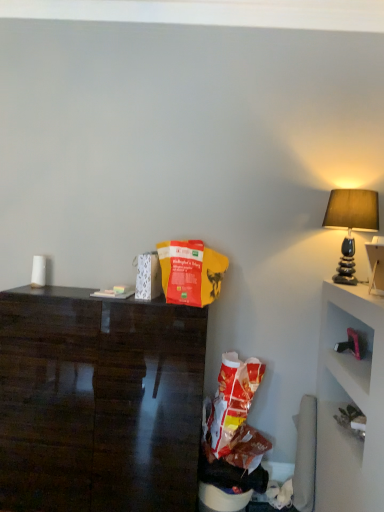
I want to click on red matte paper bag at center, so click(191, 272).

What is the approximate height of matte stone lamp at right?

22.49 inches.

Measure the distance between matte stone lamp at right and camera.

The distance of matte stone lamp at right from camera is 7.68 feet.

You are a GUI agent. You are given a task and a screenshot of the screen. Output one action in this format:
    pyautogui.click(x=<x>, y=<y>)
    Task: Click on the dark wood desk at left
    The width and height of the screenshot is (384, 512).
    Given the screenshot: What is the action you would take?
    pyautogui.click(x=98, y=403)

Based on the photo, does red matte paper bag at center come behind dark wood desk at left?

Yes, the depth of red matte paper bag at center is greater than that of dark wood desk at left.

From a real-world perspective, is red matte paper bag at center physically located above or below dark wood desk at left?

red matte paper bag at center is above dark wood desk at left.

From the picture: Can we say red matte paper bag at center lies outside dark wood desk at left?

Indeed, red matte paper bag at center is completely outside dark wood desk at left.

Locate an element on the screen. The height and width of the screenshot is (512, 384). desk below the red matte paper bag at center (from the image's perspective) is located at coordinates (98, 403).

Is point (208, 288) positioned behind point (332, 198)?

No, it is not.

From a real-world perspective, is red matte paper bag at center physically above matte stone lamp at right?

No, from a real-world perspective, red matte paper bag at center is not on top of matte stone lamp at right.

How distant is red matte paper bag at center from matte stone lamp at right?

red matte paper bag at center and matte stone lamp at right are 32.22 inches apart.

In the scene shown: Who is bigger, red matte paper bag at center or matte stone lamp at right?

With larger size is matte stone lamp at right.

Which point is more forward, (x=374, y=198) or (x=78, y=490)?

The point (x=374, y=198) is in front.

Considering the sizes of objects matte stone lamp at right and dark wood desk at left in the image provided, who is bigger, matte stone lamp at right or dark wood desk at left?

Bigger between the two is dark wood desk at left.

Locate an element on the screen. The height and width of the screenshot is (512, 384). lamp located behind the dark wood desk at left is located at coordinates (351, 224).

Considering the sizes of objects matte stone lamp at right and red matte paper bag at center in the image provided, who is smaller, matte stone lamp at right or red matte paper bag at center?

With smaller size is red matte paper bag at center.

Which of these two, matte stone lamp at right or red matte paper bag at center, is thinner?

Thinner between the two is red matte paper bag at center.

Does matte stone lamp at right turn towards red matte paper bag at center?

Yes, matte stone lamp at right faces towards red matte paper bag at center.

Is matte stone lamp at right positioned far away from red matte paper bag at center?

matte stone lamp at right is actually quite close to red matte paper bag at center.

Can you confirm if dark wood desk at left is shorter than matte stone lamp at right?

In fact, dark wood desk at left may be taller than matte stone lamp at right.

Are dark wood desk at left and matte stone lamp at right making contact?

No, dark wood desk at left is not beside matte stone lamp at right.

Is dark wood desk at left aimed at matte stone lamp at right?

No, dark wood desk at left is not oriented towards matte stone lamp at right.

Looking at this image, are dark wood desk at left and red matte paper bag at center making contact?

No, dark wood desk at left is not touching red matte paper bag at center.

From the image's perspective, does dark wood desk at left appear lower than red matte paper bag at center?

Correct, dark wood desk at left appears lower than red matte paper bag at center in the image.

Considering the relative sizes of dark wood desk at left and red matte paper bag at center in the image provided, is dark wood desk at left smaller than red matte paper bag at center?

Actually, dark wood desk at left might be larger than red matte paper bag at center.

Can you confirm if dark wood desk at left is taller than red matte paper bag at center?

Correct, dark wood desk at left is much taller as red matte paper bag at center.

The width and height of the screenshot is (384, 512). Find the location of `paper bag that appears behind the dark wood desk at left`. paper bag that appears behind the dark wood desk at left is located at coordinates (191, 272).

Locate an element on the screen. paper bag on the left of matte stone lamp at right is located at coordinates (191, 272).

Considering their positions, is red matte paper bag at center positioned further to matte stone lamp at right than dark wood desk at left?

dark wood desk at left is positioned further to the anchor matte stone lamp at right.

Looking at this image, from the image, which object appears to be farther from matte stone lamp at right, dark wood desk at left or red matte paper bag at center?

dark wood desk at left is further to matte stone lamp at right.

Based on their spatial positions, is matte stone lamp at right or red matte paper bag at center closer to dark wood desk at left?

red matte paper bag at center is positioned closer to the anchor dark wood desk at left.

Based on their spatial positions, is dark wood desk at left or matte stone lamp at right closer to red matte paper bag at center?

Among the two, dark wood desk at left is located nearer to red matte paper bag at center.

Which object lies nearer to the anchor point red matte paper bag at center, matte stone lamp at right or dark wood desk at left?

dark wood desk at left lies closer to red matte paper bag at center than the other object.

Estimate the real-world distances between objects in this image. Which object is further from dark wood desk at left, red matte paper bag at center or matte stone lamp at right?

matte stone lamp at right lies further to dark wood desk at left than the other object.

Identify the location of paper bag situated between dark wood desk at left and matte stone lamp at right from left to right. (191, 272).